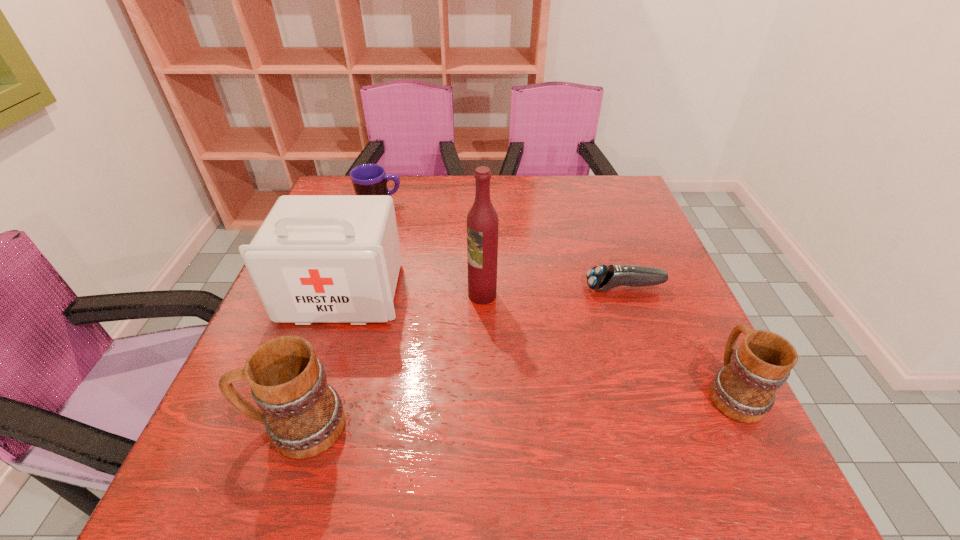
Please mark a free spot for a new mug to balance the arrangement. Please provide its 2D coordinates. Your answer should be formatted as a tuple, i.e. [(x, y)], where the tuple contains the x and y coordinates of a point satisfying the conditions above.

[(521, 408)]